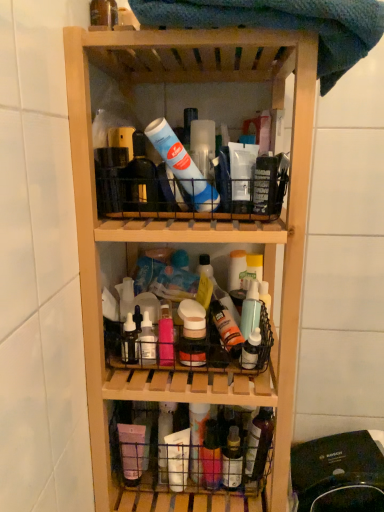
The width and height of the screenshot is (384, 512). Describe the element at coordinates (103, 14) in the screenshot. I see `translucent plastic bottle at upper left, marked as the fifth bottle in a bottom-to-top arrangement` at that location.

At what (x,y) coordinates should I click in order to perform the action: click on black plastic vacuum cleaner at lower right. Please return your answer as a coordinate pair (x, y). The width and height of the screenshot is (384, 512). Looking at the image, I should click on (340, 473).

At what (x,y) coordinates should I click in order to perform the action: click on white matte bottle at center, positioned as the second bottle in left-to-right order. Please return your answer as a coordinate pair (x, y). This screenshot has width=384, height=512. Looking at the image, I should click on (164, 437).

Where is `translucent plastic bottle at center, which appears as the 3th bottle when viewed from the left`? The width and height of the screenshot is (384, 512). translucent plastic bottle at center, which appears as the 3th bottle when viewed from the left is located at coordinates (197, 438).

This screenshot has height=512, width=384. What do you see at coordinates (250, 310) in the screenshot?
I see `translucent plastic spray bottle at center, which ranks as the 2th bottle in top-to-bottom order` at bounding box center [250, 310].

Locate an element on the screen. translucent plastic bottle at upper left, positioned as the first bottle in left-to-right order is located at coordinates (103, 14).

What's the angular difference between natural wood shelf at center and white matte bottle at center, arranged as the 4th bottle when viewed from the right,'s facing directions?

0.114 degrees.

Could you measure the distance between natural wood shelf at center and white matte bottle at center, the second bottle positioned from the bottom?

16.27 inches.

Does natural wood shelf at center have a greater width compared to white matte bottle at center, the second bottle positioned from the bottom?

Indeed, natural wood shelf at center has a greater width compared to white matte bottle at center, the second bottle positioned from the bottom.

Considering the relative sizes of natural wood shelf at center and white matte bottle at center, the second bottle positioned from the bottom, in the image provided, is natural wood shelf at center bigger than white matte bottle at center, the second bottle positioned from the bottom,?

Yes.

How different are the orientations of translucent plastic basket at lower center and blue textured towel at upper center in degrees?

The angle between the facing direction of translucent plastic basket at lower center and the facing direction of blue textured towel at upper center is 1.17 degrees.

Looking at this image, which object is thinner, translucent plastic basket at lower center or blue textured towel at upper center?

Thinner between the two is translucent plastic basket at lower center.

From the image's perspective, which object appears higher, translucent plastic basket at lower center or blue textured towel at upper center?

blue textured towel at upper center.

Does translucent plastic basket at lower center have a lesser height compared to blue textured towel at upper center?

Yes, translucent plastic basket at lower center is shorter than blue textured towel at upper center.

How far apart are blue textured towel at upper center and translucent plastic bottle at center, the 3th bottle in the top-to-bottom sequence?

28.35 inches.

Considering the sizes of objects blue textured towel at upper center and translucent plastic bottle at center, the 3th bottle in the top-to-bottom sequence, in the image provided, who is shorter, blue textured towel at upper center or translucent plastic bottle at center, the 3th bottle in the top-to-bottom sequence,?

blue textured towel at upper center.

Is blue textured towel at upper center with translucent plastic bottle at center, arranged as the third bottle when viewed from the right?

No.

Based on the photo, is blue textured towel at upper center at the left side of translucent plastic bottle at center, arranged as the third bottle when viewed from the right?

No, blue textured towel at upper center is not to the left of translucent plastic bottle at center, arranged as the third bottle when viewed from the right.

Is black plastic vacuum cleaner at lower right oriented towards blue textured towel at upper center?

No, black plastic vacuum cleaner at lower right is not turned towards blue textured towel at upper center.

Looking at this image, considering the relative positions of black plastic vacuum cleaner at lower right and blue textured towel at upper center in the image provided, is black plastic vacuum cleaner at lower right to the right of blue textured towel at upper center from the viewer's perspective?

Indeed, black plastic vacuum cleaner at lower right is positioned on the right side of blue textured towel at upper center.

How different are the orientations of black plastic vacuum cleaner at lower right and blue textured towel at upper center in degrees?

The angular difference between black plastic vacuum cleaner at lower right and blue textured towel at upper center is 1.45 degrees.

Considering the sizes of objects black plastic vacuum cleaner at lower right and blue textured towel at upper center in the image provided, who is bigger, black plastic vacuum cleaner at lower right or blue textured towel at upper center?

black plastic vacuum cleaner at lower right.

Measure the distance between natural wood shelf at center and black plastic vacuum cleaner at lower right.

A distance of 43.64 centimeters exists between natural wood shelf at center and black plastic vacuum cleaner at lower right.

From the image's perspective, is natural wood shelf at center on black plastic vacuum cleaner at lower right?

Yes, from the image's perspective, natural wood shelf at center is above black plastic vacuum cleaner at lower right.

Between point (303, 253) and point (342, 497), which one is positioned in front?

The point (303, 253) is in front.

In order to click on shelf that appears above the black plastic vacuum cleaner at lower right (from a real-world perspective) in this screenshot , I will do `click(275, 241)`.

Between white matte bottle at center, the second bottle positioned from the bottom, and matte plastic bottles at center, which one appears on the left side from the viewer's perspective?

Positioned to the left is white matte bottle at center, the second bottle positioned from the bottom.

Could you tell me if white matte bottle at center, the second bottle positioned from the bottom, is facing matte plastic bottles at center?

No, white matte bottle at center, the second bottle positioned from the bottom, is not turned towards matte plastic bottles at center.

Between white matte bottle at center, the second bottle positioned from the bottom, and matte plastic bottles at center, which one is positioned behind?

white matte bottle at center, the second bottle positioned from the bottom, is further from the camera.

Considering the sizes of white matte bottle at center, which ranks as the fourth bottle in top-to-bottom order, and matte plastic bottles at center in the image, is white matte bottle at center, which ranks as the fourth bottle in top-to-bottom order, wider or thinner than matte plastic bottles at center?

white matte bottle at center, which ranks as the fourth bottle in top-to-bottom order, is thinner than matte plastic bottles at center.

Does natural wood shelf at center turn towards translucent plastic bottle at center, which appears as the 3th bottle when viewed from the left?

Yes, natural wood shelf at center is turned towards translucent plastic bottle at center, which appears as the 3th bottle when viewed from the left.

Considering the relative sizes of natural wood shelf at center and translucent plastic bottle at center, the 3th bottle in the top-to-bottom sequence, in the image provided, is natural wood shelf at center wider than translucent plastic bottle at center, the 3th bottle in the top-to-bottom sequence,?

Yes.

Between natural wood shelf at center and translucent plastic bottle at center, arranged as the third bottle when viewed from the right, which one has less height?

With less height is translucent plastic bottle at center, arranged as the third bottle when viewed from the right.

At what (x,y) coordinates should I click in order to perform the action: click on the 1st bottle to the left of the natural wood shelf at center, starting your count from the anchor. Please return your answer as a coordinate pair (x, y). Looking at the image, I should click on (164, 437).

Find the location of a particular element. Image resolution: width=384 pixels, height=512 pixels. beach towel that is above the translucent plastic basket at lower center (from a real-world perspective) is located at coordinates (281, 24).

Based on their spatial positions, is natural wood shelf at center or matte plastic bottles at center further from blue textured towel at upper center?

The object further to blue textured towel at upper center is matte plastic bottles at center.

From the image, which object appears to be farther from translucent plastic bottle at center, the 3th bottle in the top-to-bottom sequence, black plastic vacuum cleaner at lower right or translucent plastic bottle at upper left, which is the 5th bottle from right to left?

Based on the image, translucent plastic bottle at upper left, which is the 5th bottle from right to left, appears to be further to translucent plastic bottle at center, the 3th bottle in the top-to-bottom sequence.

Estimate the real-world distances between objects in this image. Which object is further from natural wood shelf at center, black plastic vacuum cleaner at lower right or matte plastic bottles at center?

Based on the image, black plastic vacuum cleaner at lower right appears to be further to natural wood shelf at center.

Which object lies further to the anchor point black plastic vacuum cleaner at lower right, matte plastic bottles at center or translucent plastic spray bottle at center, which is the 1th bottle in right-to-left order?

The object further to black plastic vacuum cleaner at lower right is translucent plastic spray bottle at center, which is the 1th bottle in right-to-left order.

From the image, which object appears to be nearer to translucent plastic bottle at center, which appears as the 3th bottle when viewed from the left, translucent plastic bottle at upper left, positioned as the first bottle in left-to-right order, or translucent plastic basket at lower center?

The object closer to translucent plastic bottle at center, which appears as the 3th bottle when viewed from the left, is translucent plastic basket at lower center.

Based on their spatial positions, is natural wood shelf at center or white matte bottle at center, arranged as the 4th bottle when viewed from the right, further from translucent plastic basket at lower center?

Among the two, natural wood shelf at center is located further to translucent plastic basket at lower center.

Based on the photo, estimate the real-world distances between objects in this image. Which object is further from natural wood shelf at center, blue textured towel at upper center or translucent plastic basket at lower center?

Based on the image, translucent plastic basket at lower center appears to be further to natural wood shelf at center.

Based on the photo, based on their spatial positions, is natural wood shelf at center or translucent plastic bottle at center, placed as the fifth bottle when sorted from top to bottom, closer to matte plastic bottles at center?

Among the two, natural wood shelf at center is located nearer to matte plastic bottles at center.

This screenshot has width=384, height=512. I want to click on shelf between blue textured towel at upper center and translucent plastic bottle at center, acting as the second bottle starting from the right, in the vertical direction, so click(x=275, y=241).

Find the location of `bottle that lies between translucent plastic bottle at upper left, which is the 5th bottle from right to left, and matte plastic bottles at center from top to bottom`. bottle that lies between translucent plastic bottle at upper left, which is the 5th bottle from right to left, and matte plastic bottles at center from top to bottom is located at coordinates (250, 310).

What are the coordinates of `basket located between natural wood shelf at center and white matte bottle at center, the second bottle positioned from the bottom, in the depth direction` in the screenshot? It's located at (185, 448).

Identify the location of basket that lies between blue textured towel at upper center and black plastic vacuum cleaner at lower right from top to bottom. This screenshot has height=512, width=384. (185, 448).